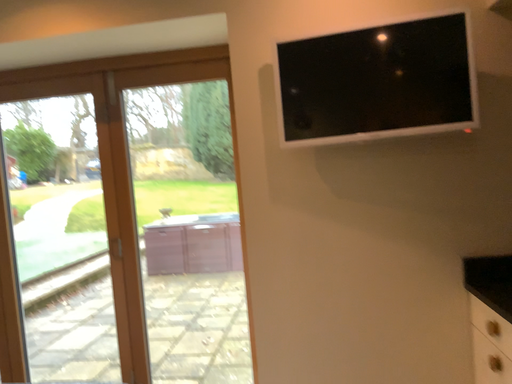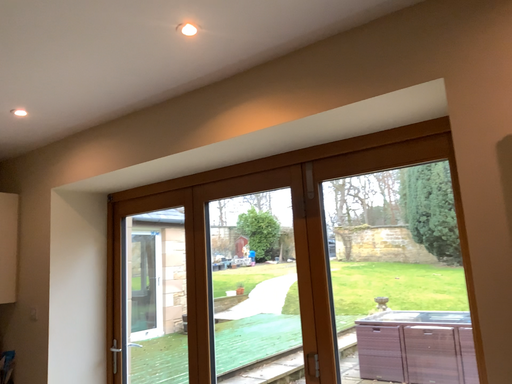
Question: Which way did the camera rotate in the video?

Choices:
 (A) rotated downward
 (B) rotated upward

Answer: (B)